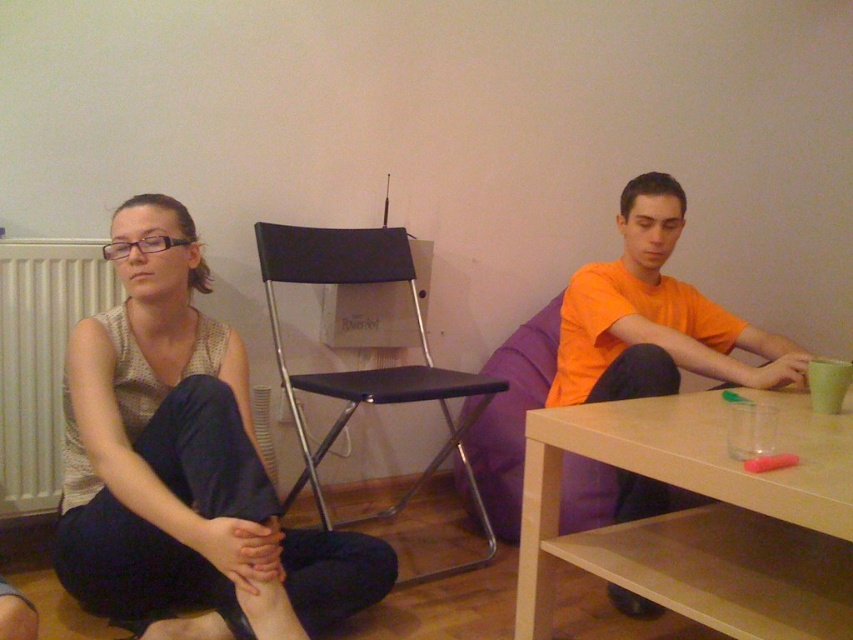
Can you confirm if light brown wood table at lower right is smaller than white matte radiator at left?

Actually, light brown wood table at lower right might be larger than white matte radiator at left.

Who is taller, light brown wood table at lower right or white matte radiator at left?

Standing taller between the two is white matte radiator at left.

The height and width of the screenshot is (640, 853). What are the coordinates of `light brown wood table at lower right` in the screenshot? It's located at (701, 516).

What are the coordinates of `light brown wood table at lower right` in the screenshot? It's located at (701, 516).

Who is positioned more to the left, matte black chair at center or black matte chair at center?

black matte chair at center

Identify the location of matte black chair at center. (668, 317).

Looking at this image, measure the distance between point (639, 337) and camera.

Point (639, 337) and camera are 6.29 feet apart from each other.

Where is `matte black chair at center`? matte black chair at center is located at coordinates (668, 317).

Who is positioned more to the right, light brown wood table at lower right or orange cotton shirt at right?

orange cotton shirt at right is more to the right.

What are the coordinates of `light brown wood table at lower right` in the screenshot? It's located at (701, 516).